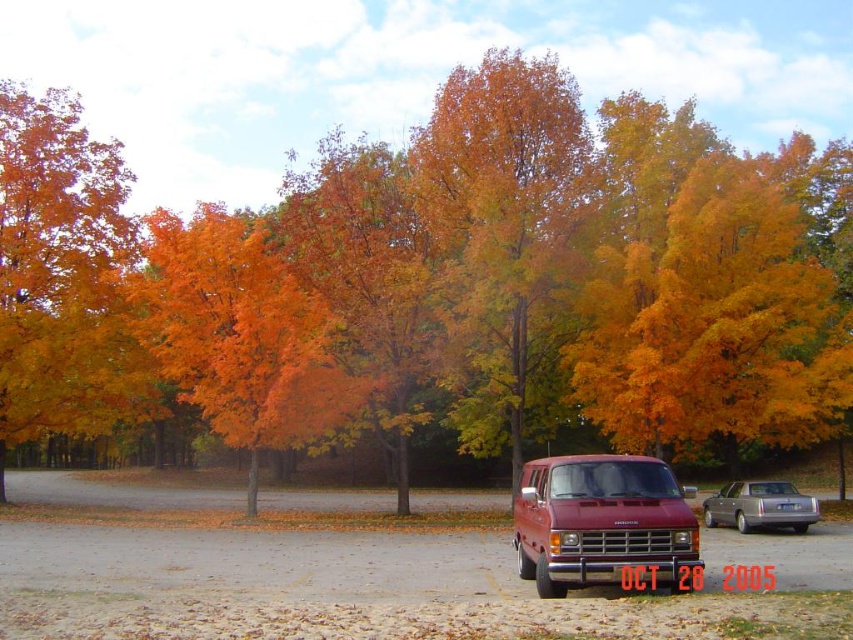
This screenshot has height=640, width=853. Identify the location of orange matte tree at center. (241, 333).

Who is more forward, (165,296) or (755,502)?

Point (755,502)

You are a GUI agent. You are given a task and a screenshot of the screen. Output one action in this format:
    pyautogui.click(x=<x>, y=<y>)
    Task: Click on the orange matte tree at center
    
    Given the screenshot: What is the action you would take?
    pyautogui.click(x=241, y=333)

Is orange matte tree at center to the left of maroon metallic van at lower right from the viewer's perspective?

Yes, orange matte tree at center is to the left of maroon metallic van at lower right.

Who is higher up, orange matte tree at center or maroon metallic van at lower right?

orange matte tree at center is above.

This screenshot has width=853, height=640. What are the coordinates of `orange matte tree at center` in the screenshot? It's located at (241, 333).

Is orange leafy tree at center taller than orange matte tree at left?

Correct, orange leafy tree at center is much taller as orange matte tree at left.

Where is `orange leafy tree at center`? The width and height of the screenshot is (853, 640). orange leafy tree at center is located at coordinates (440, 288).

Locate an element on the screen. This screenshot has width=853, height=640. orange leafy tree at center is located at coordinates (440, 288).